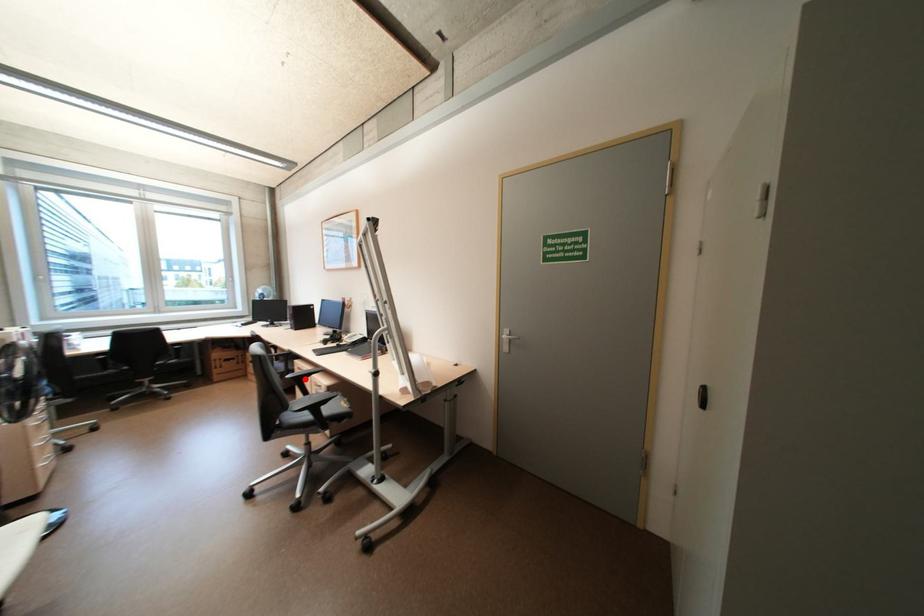
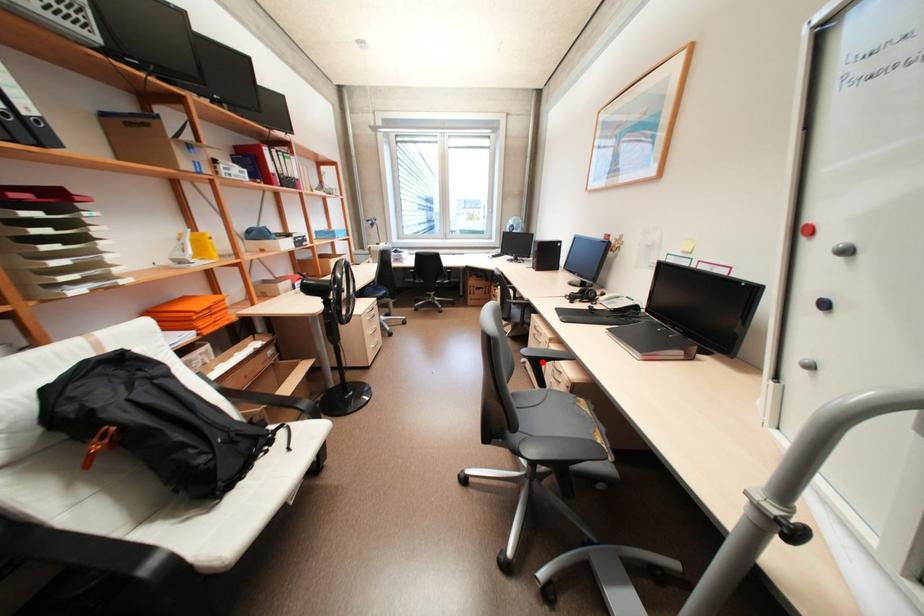
I am providing you with two images of the same scene from different viewpoints. A red point is marked on the first image and another point is marked on the second image. Are the points marked in image1 and image2 representing the same 3D position?

Yes